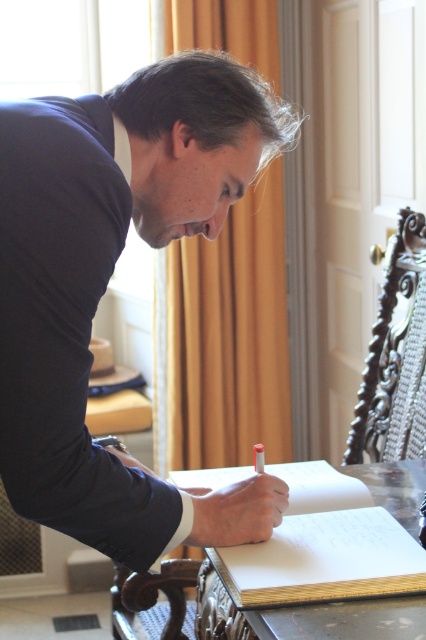
You are a photographer standing in front of the scene. You want to take a photo of the dark blue shirt at center and the wooden table at center. Which object should you focus on first if you want to capture both clearly in the same frame?

The dark blue shirt at center is located above the wooden table at center, so you should focus on the wooden table at center first to ensure both are in focus since it is closer to the camera.

You are an assistant observing the scene. There is a dark blue shirt at center and a wooden table at center. Which object is thinner?

The dark blue shirt at center is thinner than the wooden table at center.